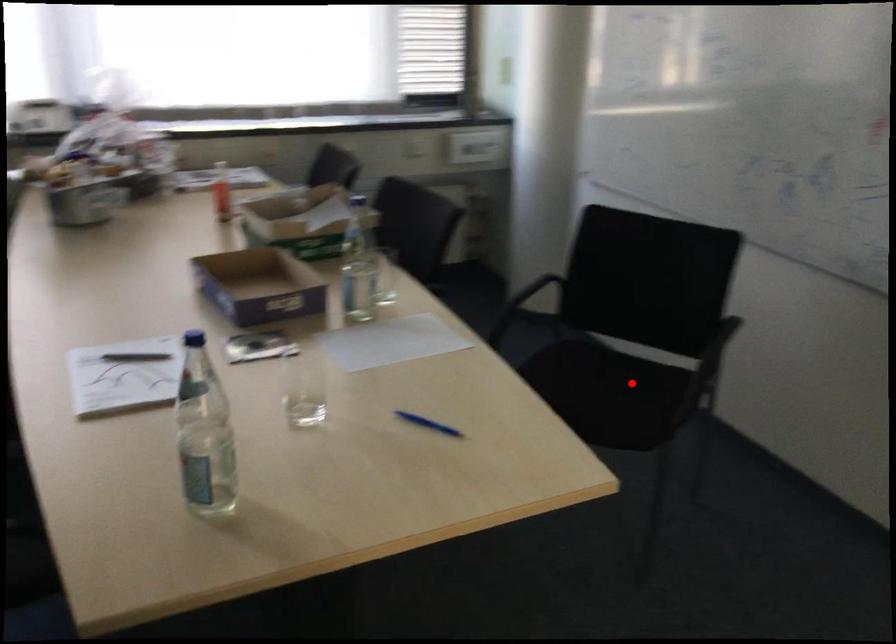
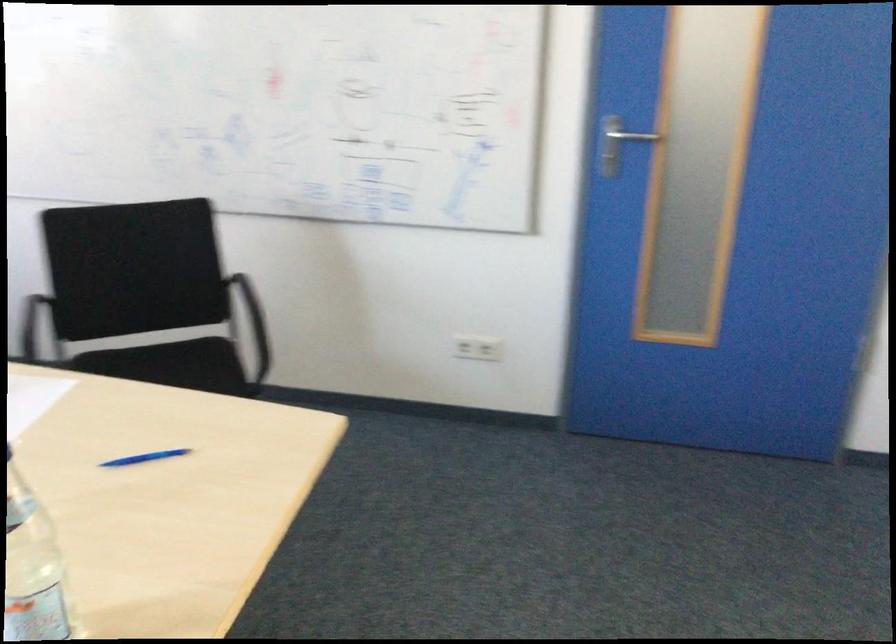
Locate, in the second image, the point that corresponds to the highlighted location in the first image.

(194, 364)